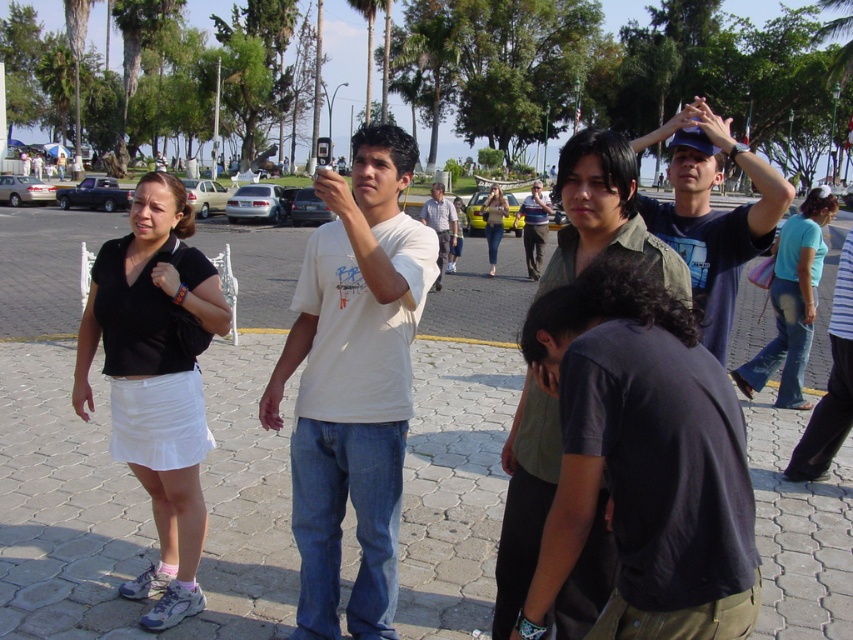
Image resolution: width=853 pixels, height=640 pixels. What do you see at coordinates (830, 387) in the screenshot? I see `light blue denim jeans at lower right` at bounding box center [830, 387].

Is light blue denim jeans at lower right shorter than matte black shirt at center?

Yes.

Who is more distant from viewer, (825, 444) or (548, 214)?

The point (548, 214) is behind.

Where is `light blue denim jeans at lower right`? This screenshot has width=853, height=640. light blue denim jeans at lower right is located at coordinates (830, 387).

Can you confirm if white cotton t-shirt at center is taller than white cotton shirt at center?

No, white cotton t-shirt at center is not taller than white cotton shirt at center.

Which is in front, point (367, 561) or point (432, 211)?

Point (367, 561)

You are a GUI agent. You are given a task and a screenshot of the screen. Output one action in this format:
    pyautogui.click(x=<x>, y=<y>)
    Task: Click on the white cotton t-shirt at center
    The height and width of the screenshot is (640, 853).
    Given the screenshot: What is the action you would take?
    pyautogui.click(x=352, y=381)

Where is `white cotton t-shirt at center`? The image size is (853, 640). white cotton t-shirt at center is located at coordinates point(352,381).

In the scene shown: Does black matte skirt at left have a lesser height compared to dark green shirt at center?

No.

Which is more to the right, black matte skirt at left or dark green shirt at center?

dark green shirt at center

Identify the location of black matte skirt at left. (155, 380).

The image size is (853, 640). I want to click on black matte skirt at left, so click(x=155, y=380).